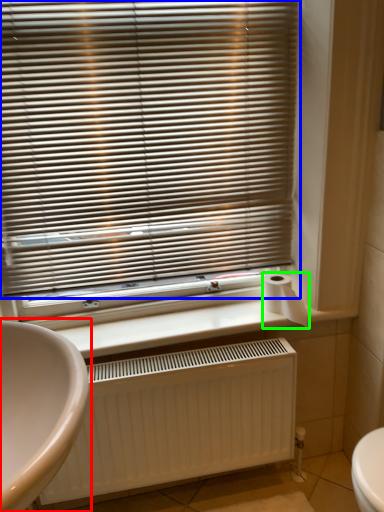
Question: Estimate the real-world distances between objects in this image. Which object is farther from sink (highlighted by a red box), window blind (highlighted by a blue box) or toilet paper (highlighted by a green box)?

Choices:
 (A) window blind
 (B) toilet paper

Answer: (B)